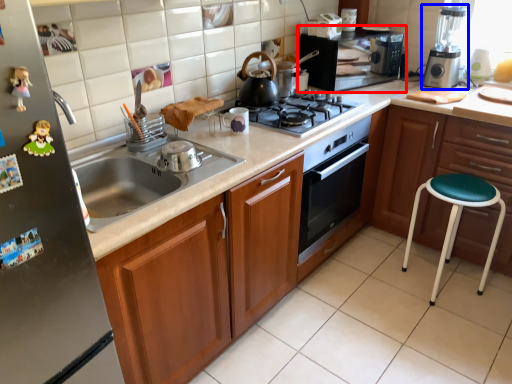
Question: Which point is closer to the camera, home appliance (highlighted by a red box) or kitchen appliance (highlighted by a blue box)?

Choices:
 (A) home appliance
 (B) kitchen appliance

Answer: (B)